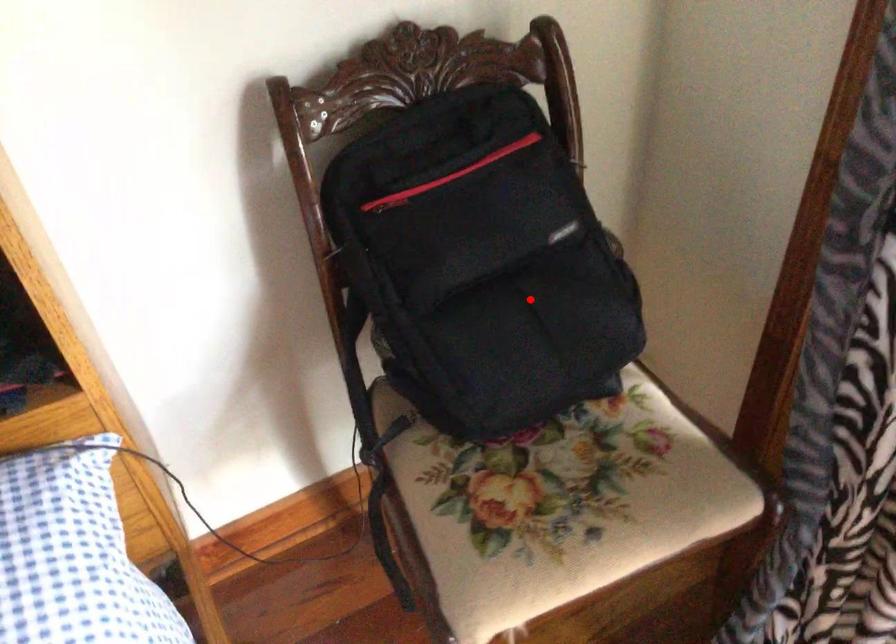
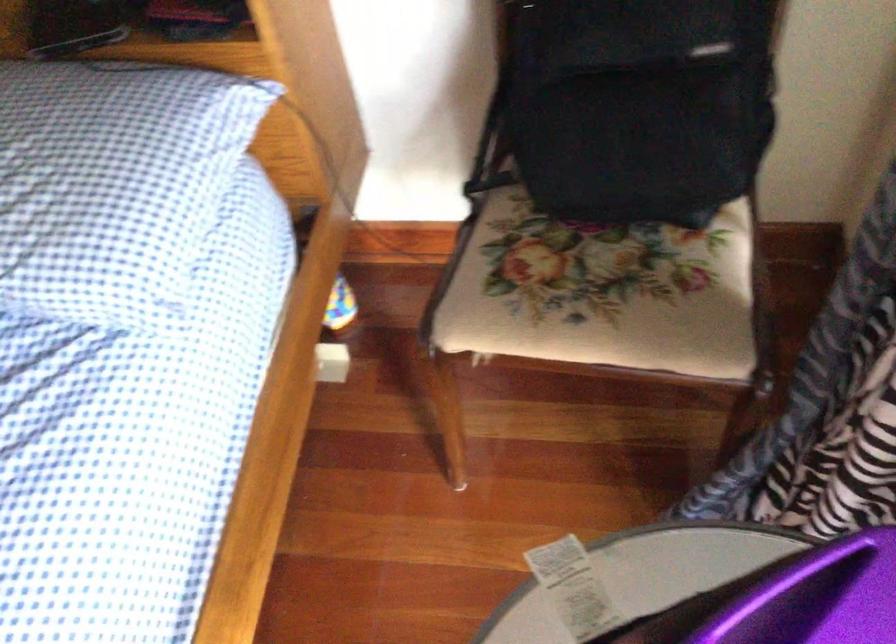
Where in the second image is the point corresponding to the highlighted location from the first image?

(639, 104)